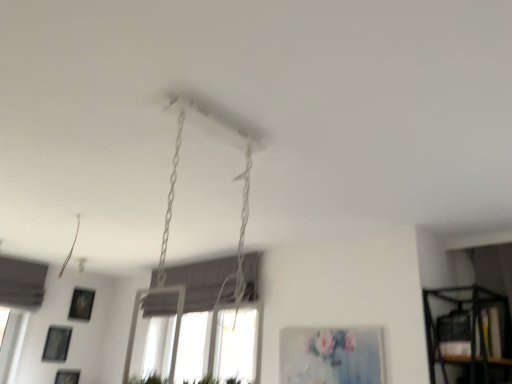
Question: Is matte blue canvas at center, acting as the fourth picture frame starting from the bottom, bigger or smaller than matte black picture frame at lower left, which ranks as the second picture frame in bottom-to-top order?

Choices:
 (A) small
 (B) big

Answer: (B)

Question: Considering the positions of matte blue canvas at center, arranged as the first picture frame when viewed from the top, and matte black picture frame at lower left, arranged as the 4th picture frame when viewed from the right, in the image, is matte blue canvas at center, arranged as the first picture frame when viewed from the top, wider or thinner than matte black picture frame at lower left, arranged as the 4th picture frame when viewed from the right,?

Choices:
 (A) thin
 (B) wide

Answer: (B)

Question: Which is farther from the matte black picture frame at lower left, the second picture frame when ordered from right to left?

Choices:
 (A) matte blue canvas at center, which appears as the 1th picture frame when viewed from the right
 (B) matte black picture frame at lower left, which appears as the 3th picture frame when viewed from the right
 (C) black plastic shelf at lower right
 (D) matte black picture frame at lower left, which ranks as the first picture frame in left-to-right order

Answer: (C)

Question: Which object is the farthest from the matte black picture frame at lower left, the 1th picture frame viewed from the back?

Choices:
 (A) black plastic shelf at lower right
 (B) matte blue canvas at center, which is the fourth picture frame from back to front
 (C) matte black picture frame at lower left, which ranks as the second picture frame in bottom-to-top order
 (D) matte black picture frame at lower left, the first picture frame when ordered from bottom to top

Answer: (A)